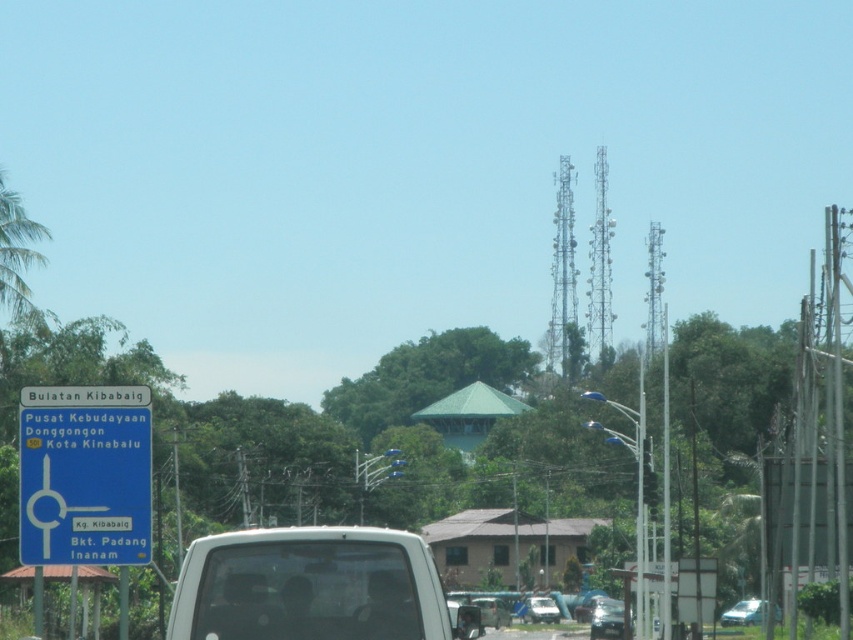
You are driving a matte black car at lower center and want to overtake the metallic silver car at center. Can you safely pass it based on their positions?

The matte black car at lower center is in front of the metallic silver car at center, so it is already ahead of it. This suggests you are already leading and overtaking may not be necessary unless there are other vehicles behind. However, based solely on their positions in the image, the matte black car is positioned in front, so overtaking isn t required.

You are a passenger in a car and looking through the windshield. You see a blue directional sign with white text in the foreground and a white van in the midground. Where is the point located at coordinate [309,586] in relation to the white matte van at center?

The point at coordinate [309,586] is located on the white matte van at center.

From the picture: You are a passenger in a car and you see the matte black car at lower center and the metallic silver car at center. Which car is taller?

The matte black car at lower center is much taller than the metallic silver car at center.